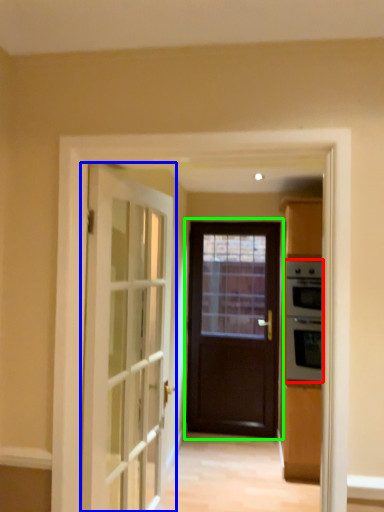
Question: Based on their relative distances, which object is farther from appliance (highlighted by a red box)? Choose from door (highlighted by a blue box) and door (highlighted by a green box).

Choices:
 (A) door
 (B) door

Answer: (A)